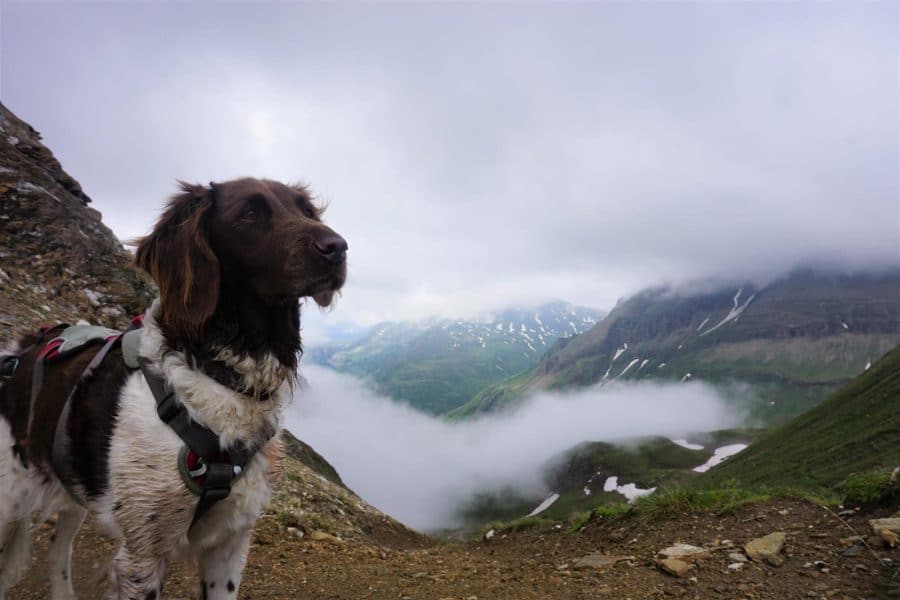
This screenshot has height=600, width=900. Identify the location of white fur. (146, 451), (28, 494).